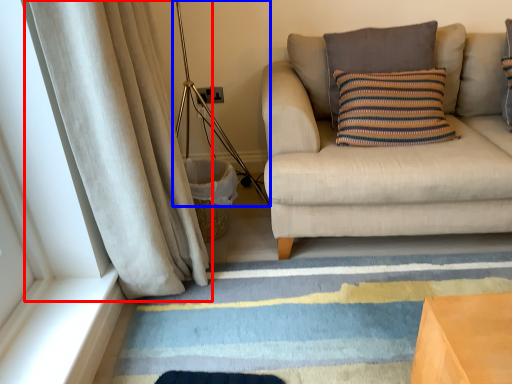
Question: Which point is closer to the camera, curtain (highlighted by a red box) or lamp (highlighted by a blue box)?

Choices:
 (A) curtain
 (B) lamp

Answer: (A)